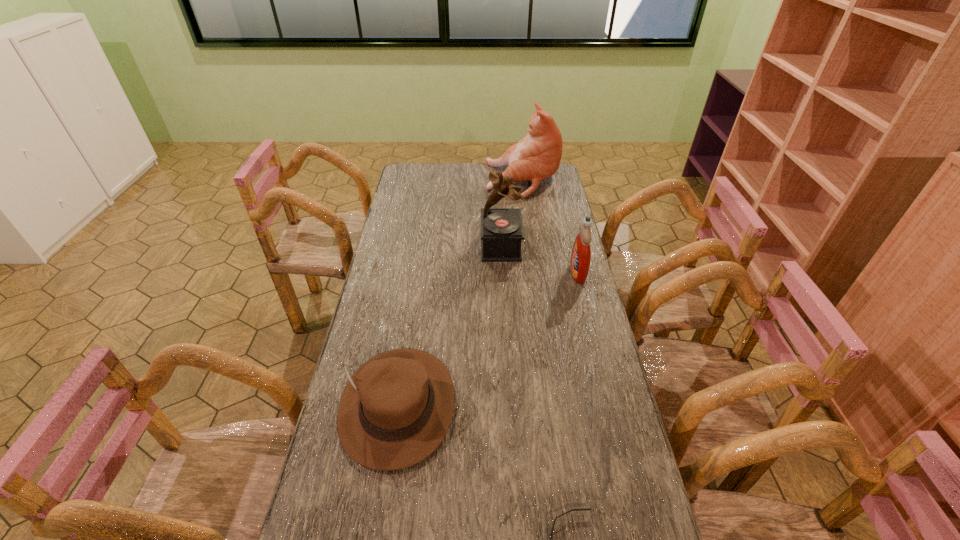
What are the coordinates of `vacant area at the left edge` in the screenshot? It's located at (388, 266).

Find the location of a particular element. blank space at the right edge is located at coordinates (562, 345).

Find the location of a particular element. vacant space at the far left corner of the desktop is located at coordinates (402, 178).

In order to click on vacant space in between the phonograph_record and the third tallest object in this screenshot , I will do `click(540, 259)`.

At what (x,y) coordinates should I click in order to perform the action: click on vacant space that's between the third tallest object and the fedora. Please return your answer as a coordinate pair (x, y). The width and height of the screenshot is (960, 540). Looking at the image, I should click on (488, 339).

At what (x,y) coordinates should I click in order to perform the action: click on vacant space that's between the fourth farthest object and the detergent. Please return your answer as a coordinate pair (x, y). This screenshot has height=540, width=960. Looking at the image, I should click on (488, 339).

Where is `empty space that is in between the detergent and the cat`? Image resolution: width=960 pixels, height=540 pixels. empty space that is in between the detergent and the cat is located at coordinates (550, 226).

Identify the location of free space between the farthest object and the detergent. (550, 226).

Find the location of `vacant point located between the phonograph_record and the second shortest object`. vacant point located between the phonograph_record and the second shortest object is located at coordinates (449, 326).

The width and height of the screenshot is (960, 540). I want to click on object that is the closest to the detergent, so click(x=502, y=232).